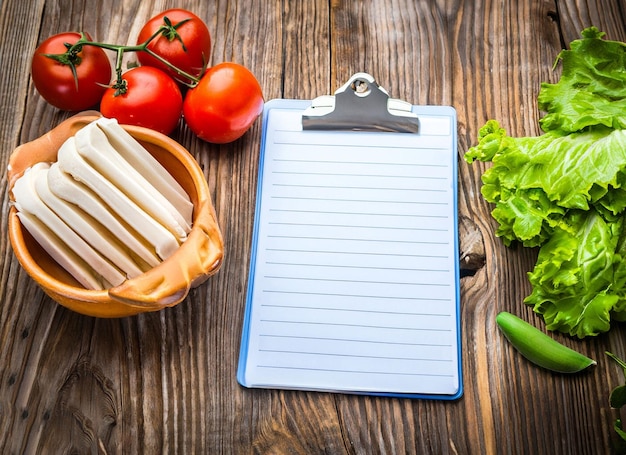
Where is `clip board`? Image resolution: width=626 pixels, height=455 pixels. clip board is located at coordinates (427, 104).